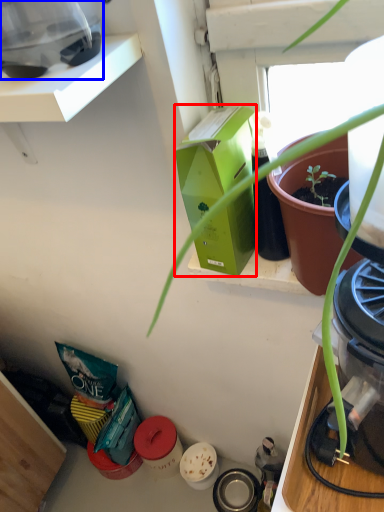
Question: Which object appears farthest to the camera in this image, box (highlighted by a red box) or appliance (highlighted by a blue box)?

Choices:
 (A) box
 (B) appliance

Answer: (A)